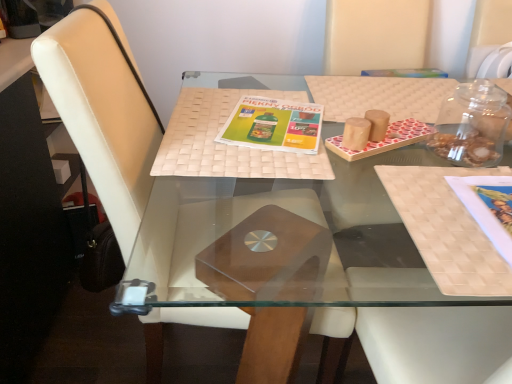
Question: Do you think wooden tray at center is within green matte magazine at center, which is the 2th book cover in right-to-left order, or outside of it?

Choices:
 (A) inside
 (B) outside

Answer: (B)

Question: Considering their positions, is wooden tray at center located in front of or behind green matte magazine at center, arranged as the second book cover when viewed from the front?

Choices:
 (A) front
 (B) behind

Answer: (A)

Question: Estimate the real-world distances between objects in this image. Which object is closer to the matte paper book cover at right, which is counted as the second book cover, starting from the top?

Choices:
 (A) transparent glass jar at upper right
 (B) green matte magazine at center, which ranks as the first book cover in back-to-front order
 (C) white leather chair at center
 (D) wooden tray at center
 (E) woven beige placemat at center

Answer: (A)

Question: Considering the real-world distances, which object is closest to the white leather chair at center?

Choices:
 (A) matte paper book cover at right, placed as the 1th book cover when sorted from front to back
 (B) green matte magazine at center, which is the 2th book cover in right-to-left order
 (C) woven beige placemat at center
 (D) transparent glass jar at upper right
 (E) wooden tray at center

Answer: (E)